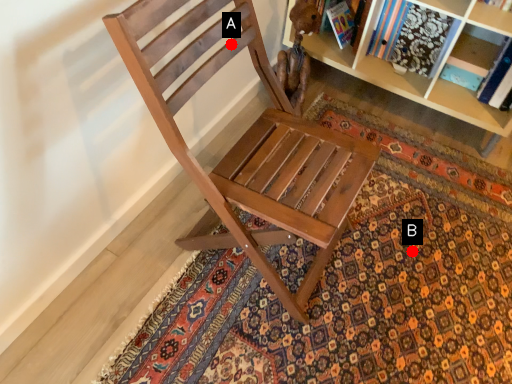
Question: Two points are circled on the image, labeled by A and B beside each circle. Which point is farther to the camera?

Choices:
 (A) A is further
 (B) B is further

Answer: (B)